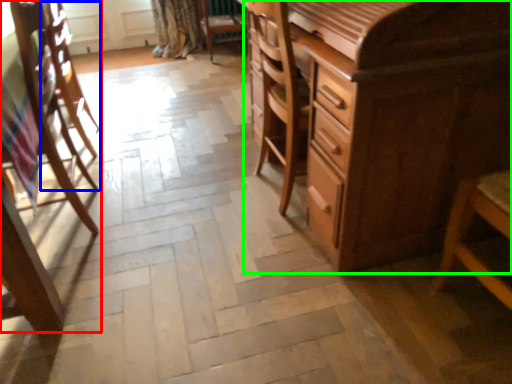
Question: Estimate the real-world distances between objects in this image. Which object is closer to chair (highlighted by a red box), armchair (highlighted by a blue box) or chest of drawers (highlighted by a green box)?

Choices:
 (A) armchair
 (B) chest of drawers

Answer: (A)